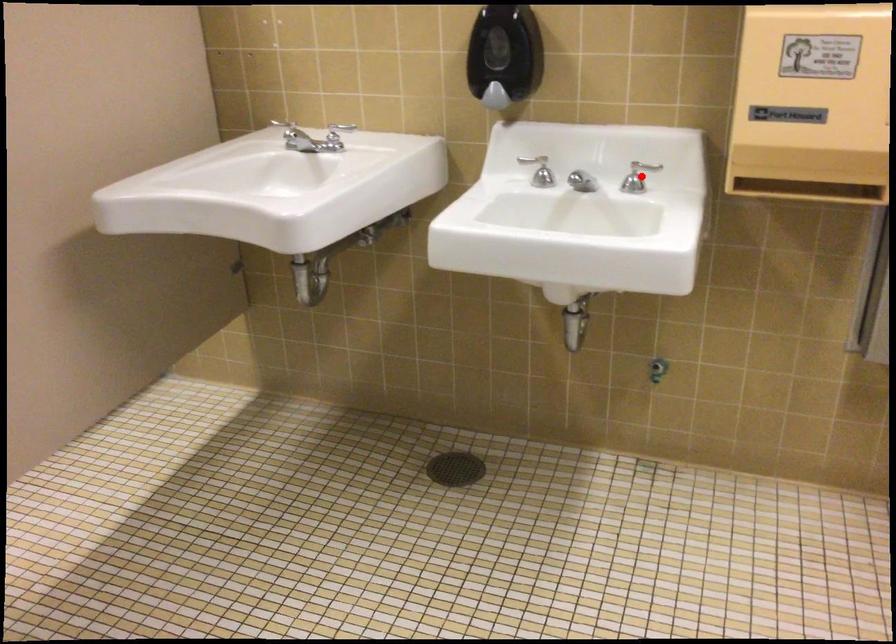
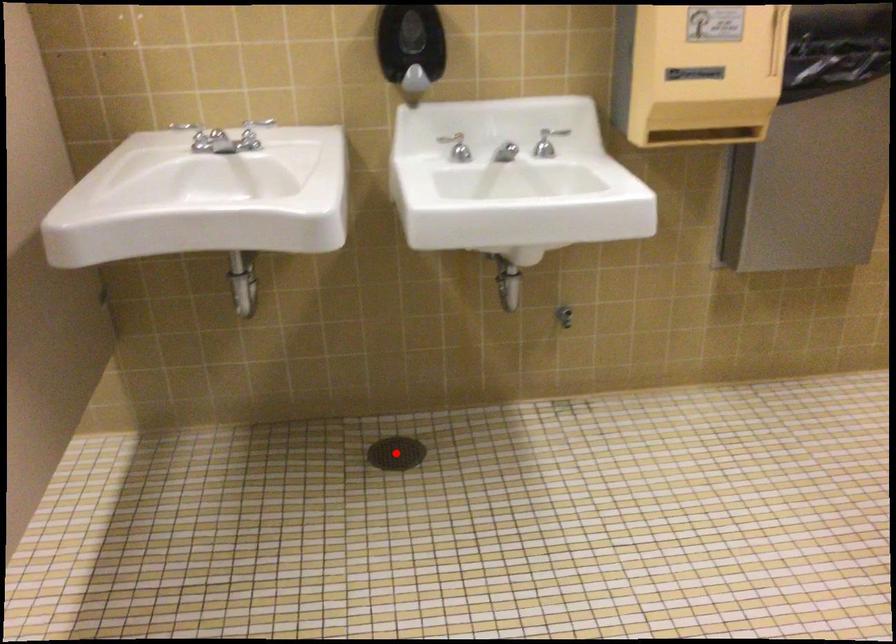
From the picture: I am providing you with two images of the same scene from different viewpoints. A red point is marked on the first image and another point is marked on the second image. Is the red point in image1 aligned with the point shown in image2?

No